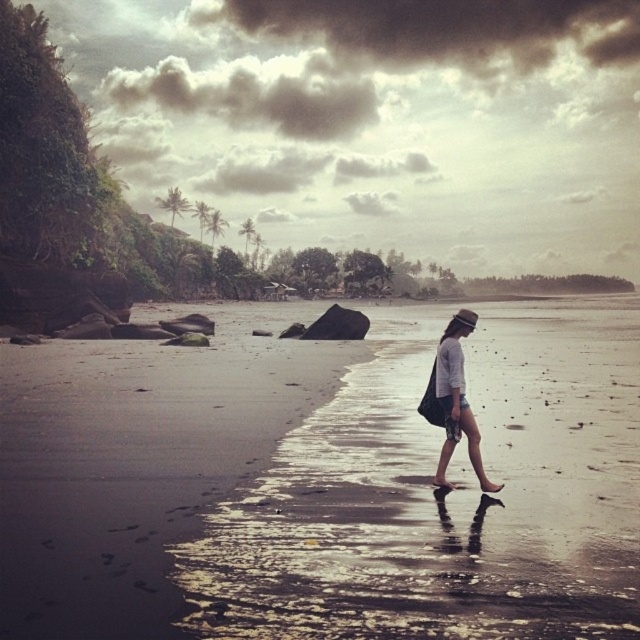
Question: Which object appears closest to the camera in this image?

Choices:
 (A) matte gray shorts at center
 (B) wet sand at center

Answer: (B)

Question: Can you confirm if wet sand at center is positioned above matte gray shorts at center?

Choices:
 (A) no
 (B) yes

Answer: (B)

Question: Which point is farther to the camera?

Choices:
 (A) wet sand at center
 (B) matte gray shorts at center

Answer: (B)

Question: Can you confirm if wet sand at center is wider than matte gray shorts at center?

Choices:
 (A) yes
 (B) no

Answer: (A)

Question: Can you confirm if wet sand at center is thinner than matte gray shorts at center?

Choices:
 (A) yes
 (B) no

Answer: (B)